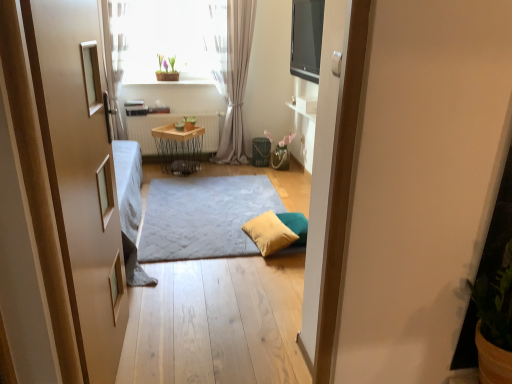
Question: From a real-world perspective, is wooden/metallic table at center on top of green matte pot at upper center?

Choices:
 (A) no
 (B) yes

Answer: (A)

Question: Is wooden/metallic table at center thinner than green matte pot at upper center?

Choices:
 (A) yes
 (B) no

Answer: (B)

Question: Does wooden/metallic table at center have a smaller size compared to green matte pot at upper center?

Choices:
 (A) yes
 (B) no

Answer: (B)

Question: From the image's perspective, is wooden/metallic table at center over green matte pot at upper center?

Choices:
 (A) no
 (B) yes

Answer: (A)

Question: Is wooden/metallic table at center looking in the opposite direction of green matte pot at upper center?

Choices:
 (A) no
 (B) yes

Answer: (A)

Question: From the image's perspective, would you say wooden/metallic table at center is shown under green matte pot at upper center?

Choices:
 (A) yes
 (B) no

Answer: (A)

Question: Would you say yellow fabric pillow at center is a long distance from green matte pot at upper center?

Choices:
 (A) yes
 (B) no

Answer: (A)

Question: Can you confirm if yellow fabric pillow at center is bigger than green matte pot at upper center?

Choices:
 (A) yes
 (B) no

Answer: (A)

Question: Is the position of yellow fabric pillow at center less distant than that of green matte pot at upper center?

Choices:
 (A) no
 (B) yes

Answer: (B)

Question: Considering the relative sizes of yellow fabric pillow at center and green matte pot at upper center in the image provided, is yellow fabric pillow at center shorter than green matte pot at upper center?

Choices:
 (A) no
 (B) yes

Answer: (B)

Question: From the image's perspective, is yellow fabric pillow at center under green matte pot at upper center?

Choices:
 (A) no
 (B) yes

Answer: (B)

Question: Considering the relative sizes of yellow fabric pillow at center and green matte pot at upper center in the image provided, is yellow fabric pillow at center smaller than green matte pot at upper center?

Choices:
 (A) no
 (B) yes

Answer: (A)

Question: Can you confirm if wooden radiator at center is thinner than light gray sheer curtain at center?

Choices:
 (A) yes
 (B) no

Answer: (A)